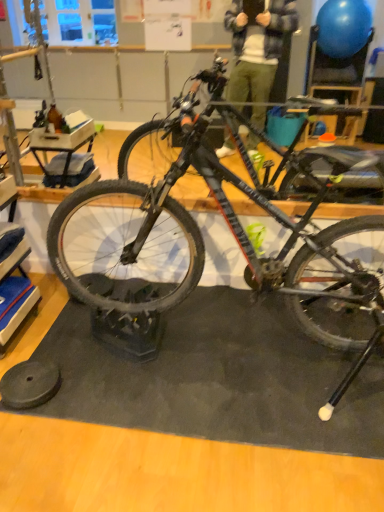
Question: Relative to matte black bicycle at center, is black rubber wheel at lower left in front or behind?

Choices:
 (A) front
 (B) behind

Answer: (B)

Question: Do you think black rubber wheel at lower left is within matte black bicycle at center, or outside of it?

Choices:
 (A) outside
 (B) inside

Answer: (A)

Question: Based on their relative distances, which object is farther from the matte black bicycle at center?

Choices:
 (A) shiny black tire at center
 (B) black rubber wheel at lower left

Answer: (B)

Question: Which of these objects is positioned closest to the matte black bicycle at center?

Choices:
 (A) black rubber wheel at lower left
 (B) shiny black tire at center

Answer: (B)